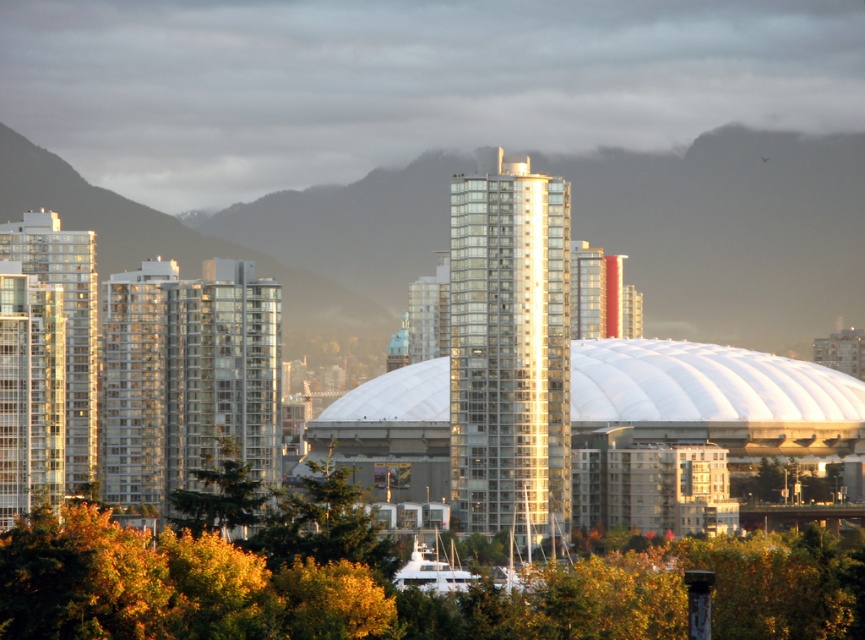
Does glassy reflective building at left appear on the right side of green leafy tree at lower left?

In fact, glassy reflective building at left is to the left of green leafy tree at lower left.

Is point (55, 465) farther from viewer compared to point (215, 468)?

Yes.

Describe the element at coordinates (45, 362) in the screenshot. I see `glassy reflective building at left` at that location.

At what (x,y) coordinates should I click in order to perform the action: click on glassy reflective building at left. Please return your answer as a coordinate pair (x, y). The image size is (865, 640). Looking at the image, I should click on (45, 362).

Is green leafy tree at lower center below shiny glass skyscraper at center?

Indeed, green leafy tree at lower center is positioned under shiny glass skyscraper at center.

Is green leafy tree at lower center taller than shiny glass skyscraper at center?

In fact, green leafy tree at lower center may be shorter than shiny glass skyscraper at center.

Is point (74, 561) positioned behind point (450, 449)?

Yes, point (74, 561) is behind point (450, 449).

Where is `green leafy tree at lower center`? The height and width of the screenshot is (640, 865). green leafy tree at lower center is located at coordinates (407, 588).

Is glassy reflective building at left below green leafy tree at center?

No.

Who is more forward, (26,301) or (785,474)?

Point (26,301) is more forward.

Find the location of a particular element. Image resolution: width=865 pixels, height=640 pixels. glassy reflective building at left is located at coordinates (45, 362).